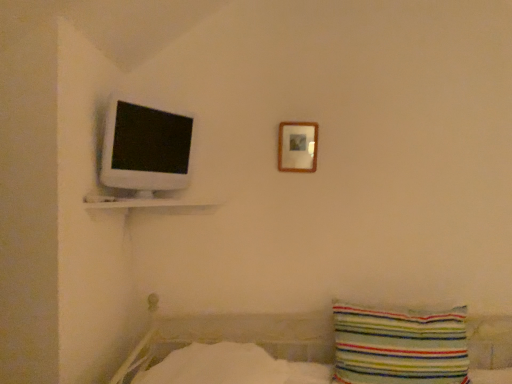
Question: Can you confirm if white glossy computer monitor at upper left is wider than striped fabric pillow at lower right?

Choices:
 (A) no
 (B) yes

Answer: (A)

Question: From the image's perspective, is white glossy computer monitor at upper left on striped fabric pillow at lower right?

Choices:
 (A) yes
 (B) no

Answer: (A)

Question: From the image's perspective, is white glossy computer monitor at upper left under striped fabric pillow at lower right?

Choices:
 (A) no
 (B) yes

Answer: (A)

Question: Is white glossy computer monitor at upper left facing towards striped fabric pillow at lower right?

Choices:
 (A) no
 (B) yes

Answer: (A)

Question: Is white glossy computer monitor at upper left smaller than striped fabric pillow at lower right?

Choices:
 (A) no
 (B) yes

Answer: (B)

Question: Considering the relative positions of white glossy computer monitor at upper left and striped fabric pillow at lower right in the image provided, is white glossy computer monitor at upper left behind striped fabric pillow at lower right?

Choices:
 (A) no
 (B) yes

Answer: (A)

Question: Is there a large distance between wooden picture frame at upper center and white glossy computer monitor at upper left?

Choices:
 (A) yes
 (B) no

Answer: (B)

Question: Is wooden picture frame at upper center further to the viewer compared to white glossy computer monitor at upper left?

Choices:
 (A) no
 (B) yes

Answer: (B)

Question: From the image's perspective, does wooden picture frame at upper center appear lower than white glossy computer monitor at upper left?

Choices:
 (A) no
 (B) yes

Answer: (A)

Question: From a real-world perspective, is wooden picture frame at upper center physically below white glossy computer monitor at upper left?

Choices:
 (A) yes
 (B) no

Answer: (B)

Question: Can white glossy computer monitor at upper left be found inside wooden picture frame at upper center?

Choices:
 (A) yes
 (B) no

Answer: (B)

Question: Considering the relative sizes of wooden picture frame at upper center and white glossy computer monitor at upper left in the image provided, is wooden picture frame at upper center shorter than white glossy computer monitor at upper left?

Choices:
 (A) yes
 (B) no

Answer: (A)

Question: Is white glossy shelf at upper left further to the viewer compared to striped fabric pillow at lower right?

Choices:
 (A) no
 (B) yes

Answer: (A)